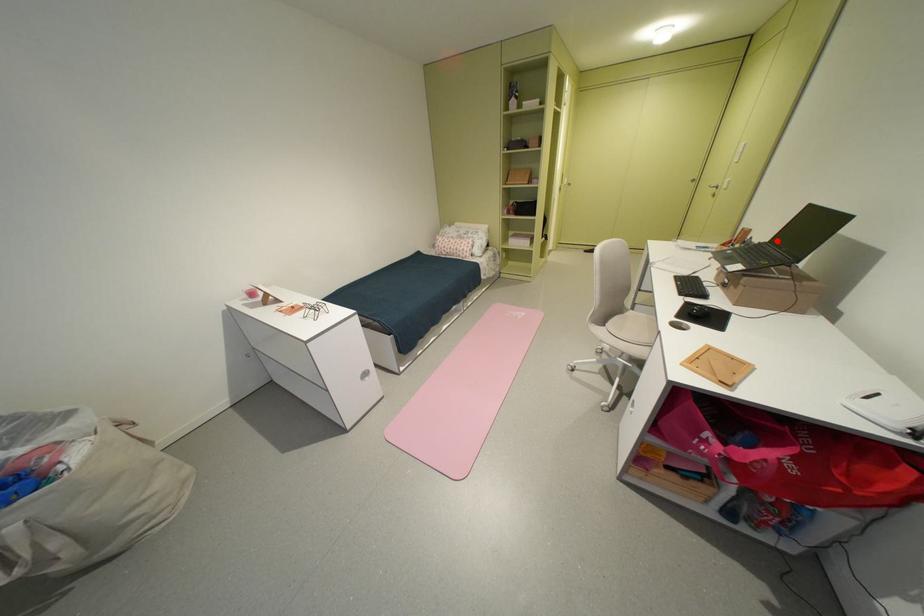
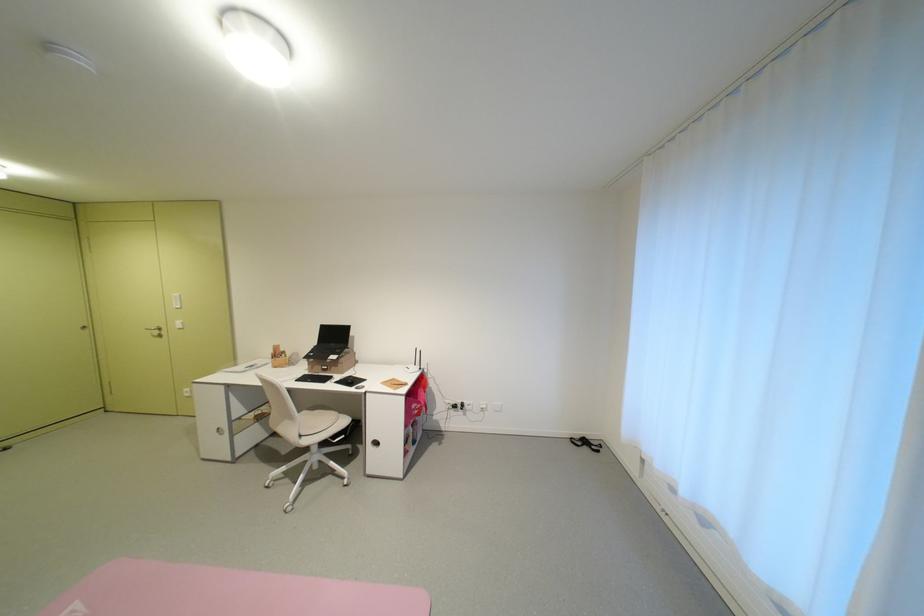
Where in the second image is the point corresponding to the highlighted location from the first image?

(324, 345)